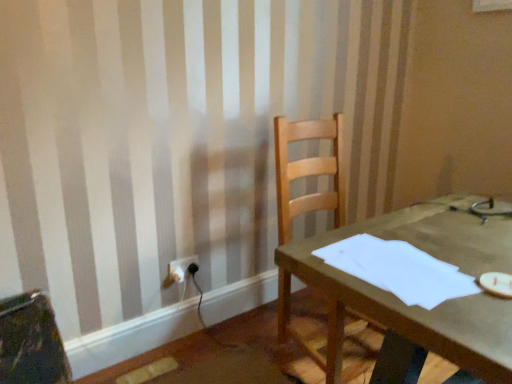
What do you see at coordinates (180, 268) in the screenshot?
I see `white plastic electric outlet at lower left` at bounding box center [180, 268].

The image size is (512, 384). I want to click on white paper at center, so click(x=399, y=270).

Locate an element on the screen. Image resolution: width=512 pixels, height=384 pixels. white plastic electric outlet at lower left is located at coordinates (180, 268).

Measure the distance from white paper at center to wooden chair at center.

white paper at center and wooden chair at center are 23.62 inches apart.

Considering the relative positions of white paper at center and wooden chair at center in the image provided, is white paper at center to the right of wooden chair at center from the viewer's perspective?

Incorrect, white paper at center is not on the right side of wooden chair at center.

Based on the photo, from the image's perspective, between white paper at center and wooden chair at center, who is located below?

wooden chair at center appears lower in the image.

Based on the photo, can you tell me how much white paper at center and wooden chair at center differ in facing direction?

The angular difference between white paper at center and wooden chair at center is 85.8 degrees.

Is white plastic electric outlet at lower left thinner than wooden chair at center?

Correct, the width of white plastic electric outlet at lower left is less than that of wooden chair at center.

The width and height of the screenshot is (512, 384). Find the location of `chair above the white plastic electric outlet at lower left (from the image's perspective)`. chair above the white plastic electric outlet at lower left (from the image's perspective) is located at coordinates (308, 171).

In the scene shown: From a real-world perspective, between white plastic electric outlet at lower left and wooden chair at center, who is vertically higher?

wooden chair at center, from a real-world perspective.

From a real-world perspective, which object rests below the other?

From a 3D spatial view, white plastic electric outlet at lower left is below.

Is white paper at center placed right next to white plastic electric outlet at lower left?

No, white paper at center is not beside white plastic electric outlet at lower left.

Where is `paper in front of the white plastic electric outlet at lower left`? Image resolution: width=512 pixels, height=384 pixels. paper in front of the white plastic electric outlet at lower left is located at coordinates (399, 270).

Is white paper at center closer to camera compared to white plastic electric outlet at lower left?

Yes, the depth of white paper at center is less than that of white plastic electric outlet at lower left.

Is white plastic electric outlet at lower left shorter than white paper at center?

Incorrect, the height of white plastic electric outlet at lower left does not fall short of that of white paper at center.

From the picture: From the image's perspective, which is below, white plastic electric outlet at lower left or white paper at center?

From the image's view, white plastic electric outlet at lower left is below.

Is wooden chair at center oriented towards white plastic electric outlet at lower left?

No, wooden chair at center is not aimed at white plastic electric outlet at lower left.

Does point (281, 126) come in front of point (182, 263)?

Yes, it is in front of point (182, 263).

From the image's perspective, is wooden chair at center above white plastic electric outlet at lower left?

Correct, wooden chair at center appears higher than white plastic electric outlet at lower left in the image.

Is wooden chair at center at the right side of white paper at center?

Indeed, wooden chair at center is positioned on the right side of white paper at center.

Which is in front, point (280, 294) or point (446, 276)?

The point (446, 276) is more forward.

Is wooden chair at center directly adjacent to white paper at center?

No, wooden chair at center is not with white paper at center.

Based on their sizes in the image, would you say wooden chair at center is bigger or smaller than white paper at center?

In the image, wooden chair at center appears to be larger than white paper at center.

You are a GUI agent. You are given a task and a screenshot of the screen. Output one action in this format:
    pyautogui.click(x=<x>, y=<y>)
    Task: Click on the chair that appears behind the white paper at center
    
    Given the screenshot: What is the action you would take?
    pyautogui.click(x=308, y=171)

Find the location of a particular element. The width and height of the screenshot is (512, 384). electric outlet that appears below the wooden chair at center (from a real-world perspective) is located at coordinates (180, 268).

Based on their spatial positions, is white paper at center or wooden chair at center further from white plastic electric outlet at lower left?

The object further to white plastic electric outlet at lower left is white paper at center.

Based on their spatial positions, is wooden chair at center or white paper at center further from white plastic electric outlet at lower left?

Among the two, white paper at center is located further to white plastic electric outlet at lower left.

From the image, which object appears to be nearer to white paper at center, white plastic electric outlet at lower left or wooden chair at center?

wooden chair at center is closer to white paper at center.

Which object lies further to the anchor point white paper at center, wooden chair at center or white plastic electric outlet at lower left?

Based on the image, white plastic electric outlet at lower left appears to be further to white paper at center.

When comparing their distances from wooden chair at center, does white plastic electric outlet at lower left or white paper at center seem further?

white plastic electric outlet at lower left is positioned further to the anchor wooden chair at center.

Based on their spatial positions, is white paper at center or white plastic electric outlet at lower left closer to wooden chair at center?

Among the two, white paper at center is located nearer to wooden chair at center.

Where is `chair between white paper at center and white plastic electric outlet at lower left along the z-axis`? The width and height of the screenshot is (512, 384). chair between white paper at center and white plastic electric outlet at lower left along the z-axis is located at coordinates (308, 171).